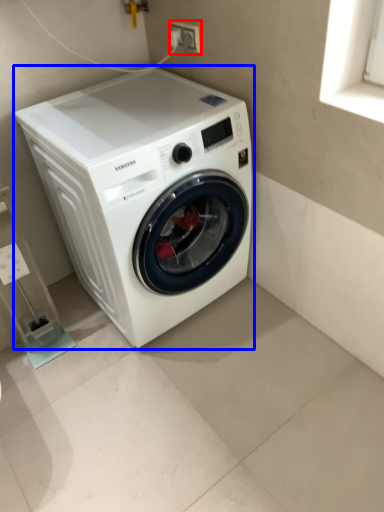
Question: Which of the following is the farthest to the observer, electric outlet (highlighted by a red box) or washing machine (highlighted by a blue box)?

Choices:
 (A) electric outlet
 (B) washing machine

Answer: (A)